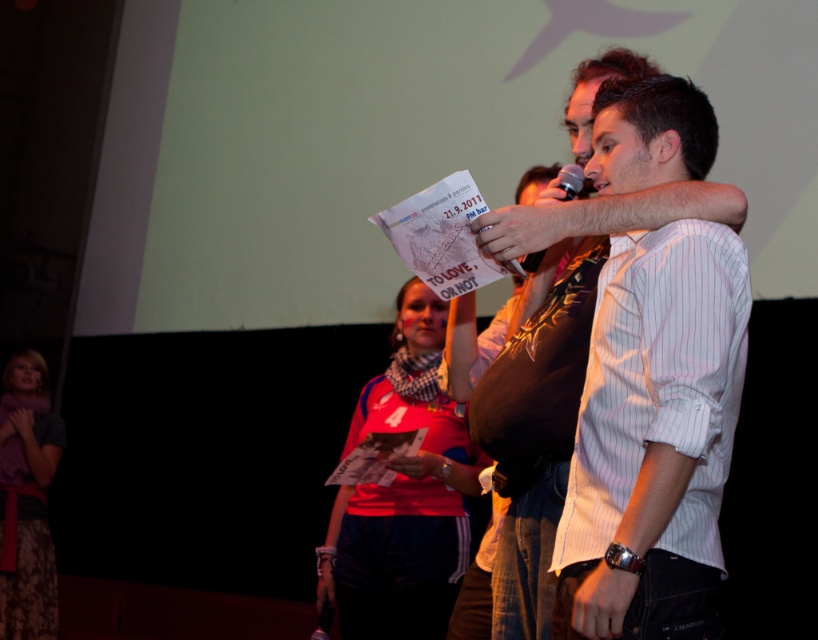
Question: Estimate the real-world distances between objects in this image. Which object is closer to the white pinstripe shirt at center?

Choices:
 (A) white striped shirt at center
 (B) velvet purple scarf at lower left

Answer: (A)

Question: Which point is closer to the camera?

Choices:
 (A) (590, 177)
 (B) (691, 237)

Answer: (B)

Question: Is white pinstripe shirt at center to the right of metallic silver microphone at upper center from the viewer's perspective?

Choices:
 (A) yes
 (B) no

Answer: (A)

Question: Considering the relative positions of white pinstripe shirt at center and velvet purple scarf at lower left in the image provided, where is white pinstripe shirt at center located with respect to velvet purple scarf at lower left?

Choices:
 (A) below
 (B) above

Answer: (B)

Question: Does white pinstripe shirt at center appear on the right side of velvet purple scarf at lower left?

Choices:
 (A) yes
 (B) no

Answer: (A)

Question: Estimate the real-world distances between objects in this image. Which object is closer to the white striped shirt at center?

Choices:
 (A) metallic silver microphone at upper center
 (B) velvet purple scarf at lower left
 (C) matte pink shirt at center
 (D) white pinstripe shirt at center

Answer: (D)